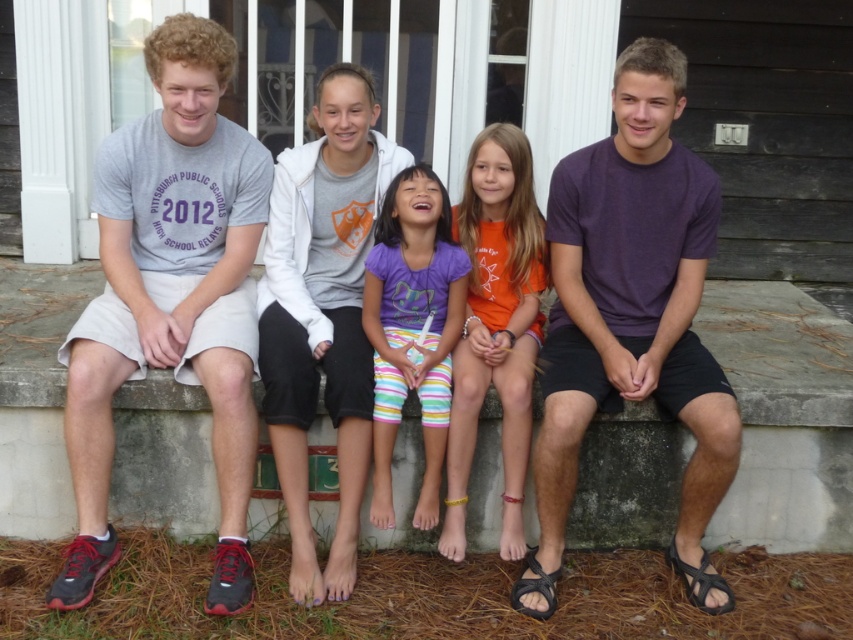
Question: Is white soft hoodie at center wider than purple cotton shirt at center?

Choices:
 (A) no
 (B) yes

Answer: (B)

Question: Considering the real-world distances, which object is closest to the white soft hoodie at center?

Choices:
 (A) purple cotton shirt at center
 (B) gray cotton t-shirt at left
 (C) orange cotton shirt at center
 (D) purple cotton shirt at right

Answer: (A)

Question: Which point appears farthest from the camera in this image?

Choices:
 (A) pos(479,339)
 (B) pos(387,492)
 (C) pos(270,196)

Answer: (C)

Question: Does orange cotton shirt at center have a lesser width compared to purple cotton shirt at center?

Choices:
 (A) no
 (B) yes

Answer: (A)

Question: Does white soft hoodie at center appear over purple cotton shirt at center?

Choices:
 (A) no
 (B) yes

Answer: (B)

Question: Which object is positioned closest to the orange cotton shirt at center?

Choices:
 (A) gray cotton t-shirt at left
 (B) white soft hoodie at center
 (C) purple cotton shirt at right

Answer: (C)